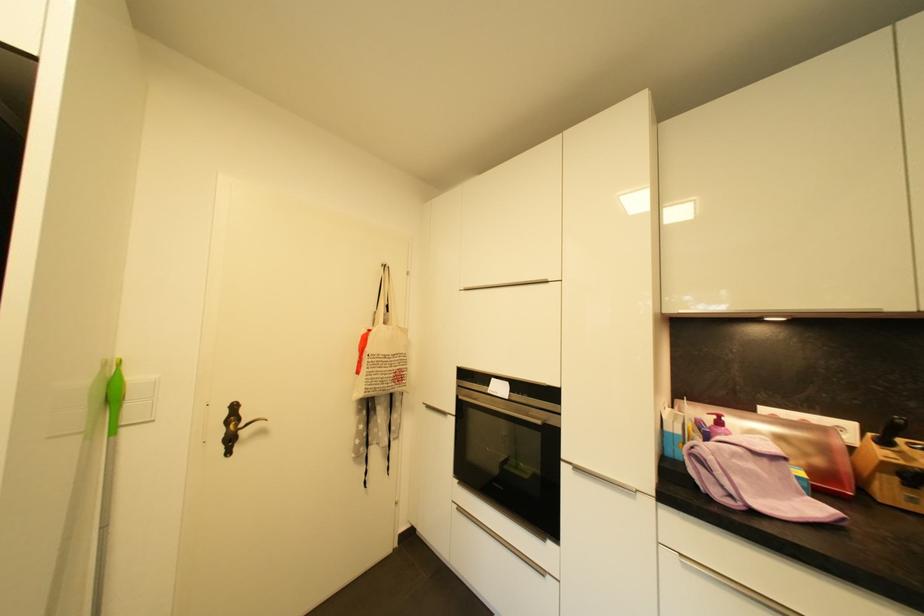
At what (x,y) coordinates should I click in order to perform the action: click on dark door handle. Please return your answer as a coordinate pair (x, y). Image resolution: width=924 pixels, height=616 pixels. Looking at the image, I should click on (232, 428).